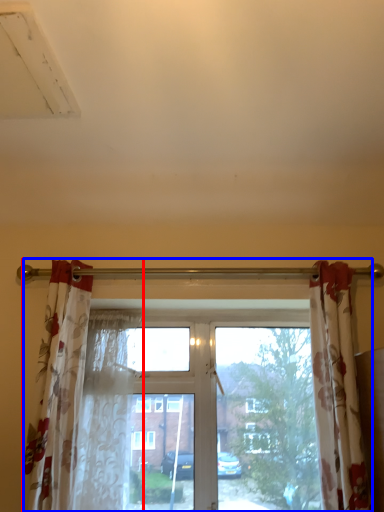
Question: Among these objects, which one is farthest to the camera, curtain (highlighted by a red box) or window (highlighted by a blue box)?

Choices:
 (A) curtain
 (B) window

Answer: (B)